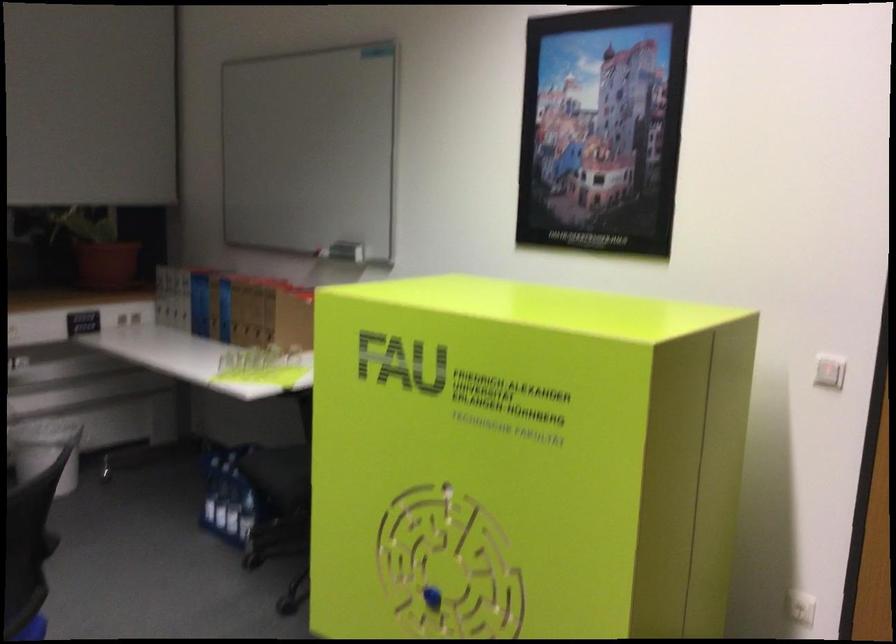
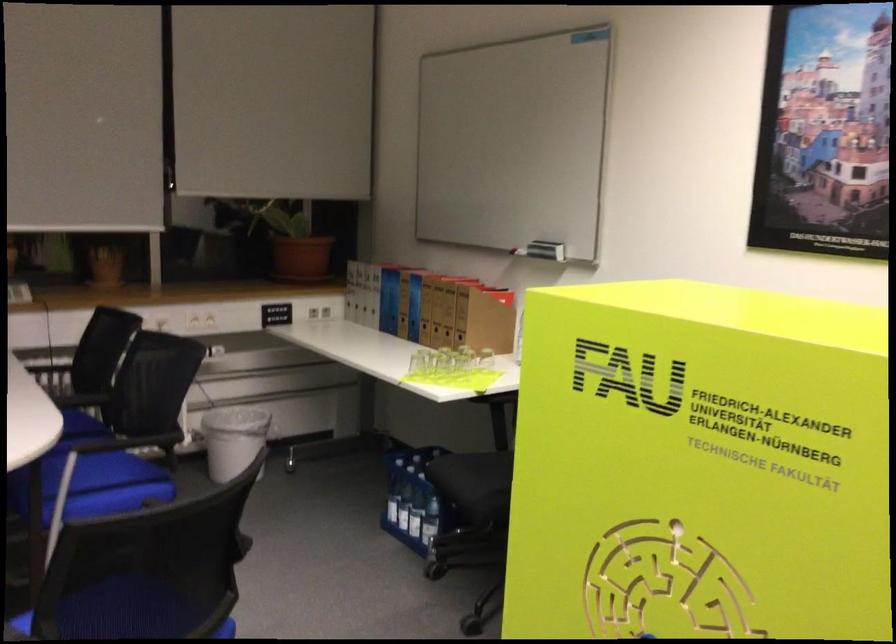
Where in the second image is the point corresponding to (346,252) from the first image?

(546, 250)